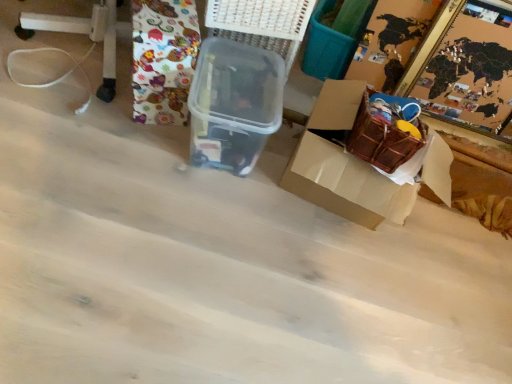
Where is `vacant space that is to the left of transparent plastic container at center`? This screenshot has width=512, height=384. vacant space that is to the left of transparent plastic container at center is located at coordinates (118, 123).